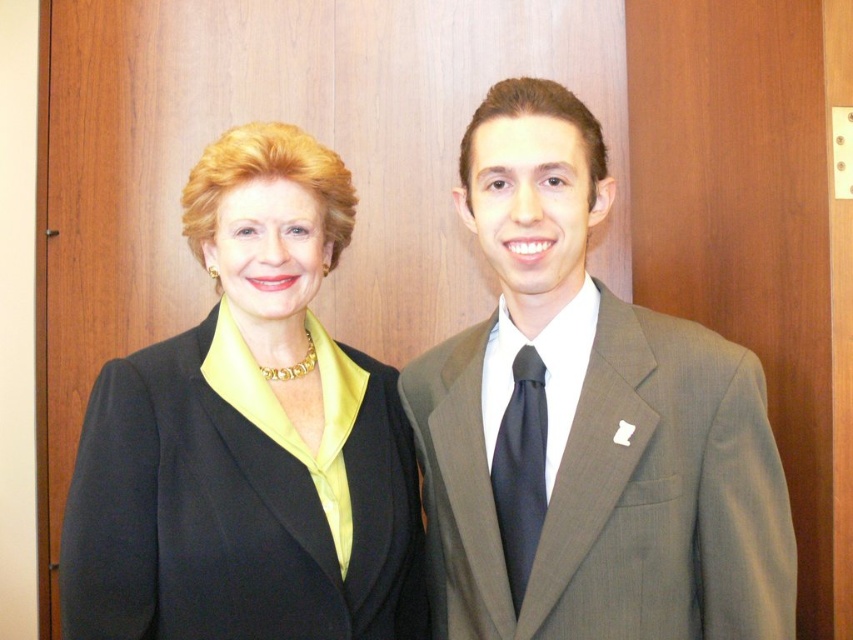
Question: Considering the real-world distances, which object is closest to the black satin tie at center?

Choices:
 (A) black matte suit at left
 (B) matte gray suit at center

Answer: (B)

Question: From the image, what is the correct spatial relationship of matte gray suit at center in relation to black satin tie at center?

Choices:
 (A) below
 (B) above

Answer: (B)

Question: Can you confirm if matte gray suit at center is positioned to the left of black matte suit at left?

Choices:
 (A) no
 (B) yes

Answer: (A)

Question: Does black matte suit at left lie in front of black satin tie at center?

Choices:
 (A) yes
 (B) no

Answer: (B)

Question: Which object is positioned closest to the black satin tie at center?

Choices:
 (A) black matte suit at left
 (B) matte gray suit at center

Answer: (B)

Question: Which object is closer to the camera taking this photo?

Choices:
 (A) black matte suit at left
 (B) black satin tie at center
 (C) matte gray suit at center

Answer: (C)